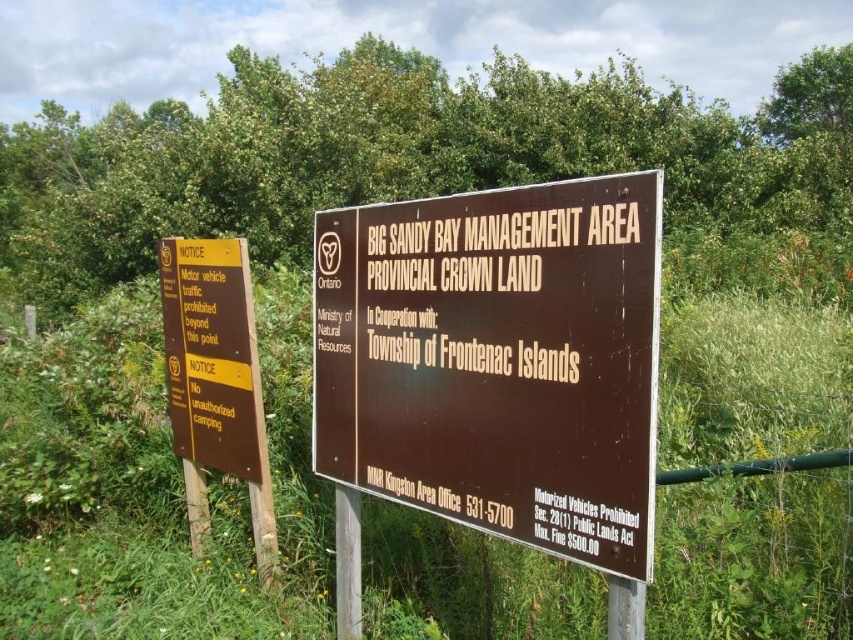
Is brown wooden sign at center to the right of yellow paper at left from the viewer's perspective?

Yes, brown wooden sign at center is to the right of yellow paper at left.

Is brown wooden sign at center taller than yellow paper at left?

In fact, brown wooden sign at center may be shorter than yellow paper at left.

The height and width of the screenshot is (640, 853). Describe the element at coordinates (497, 360) in the screenshot. I see `brown wooden sign at center` at that location.

Locate an element on the screen. The image size is (853, 640). brown wooden sign at center is located at coordinates (497, 360).